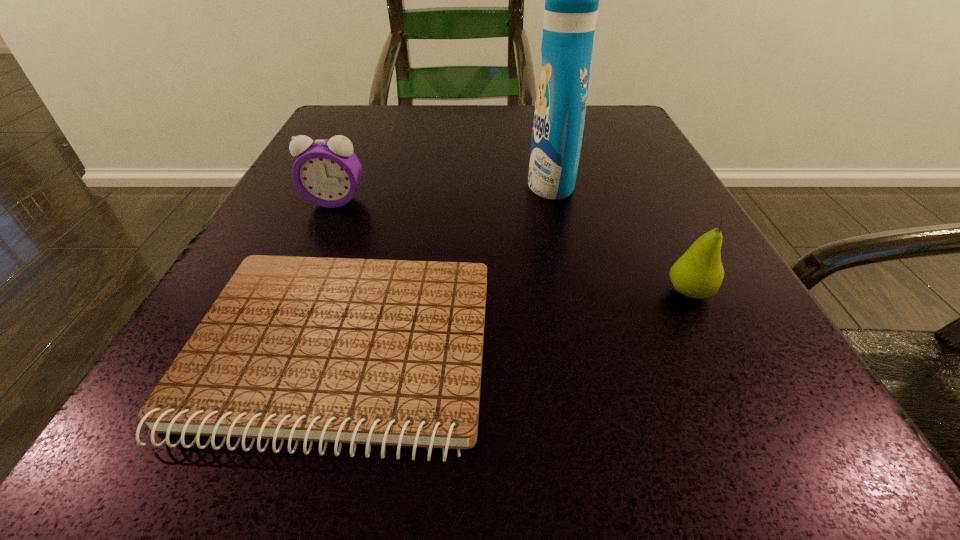
Find the location of `blank space located 0.100m on the back of the notebook`. blank space located 0.100m on the back of the notebook is located at coordinates (379, 228).

Image resolution: width=960 pixels, height=540 pixels. Find the location of `object that is at the near edge`. object that is at the near edge is located at coordinates (387, 352).

Locate an element on the screen. alarm clock that is at the left edge is located at coordinates (327, 173).

This screenshot has height=540, width=960. What are the coordinates of `notebook at the left edge` in the screenshot? It's located at (387, 352).

What are the coordinates of `object situated at the right edge` in the screenshot? It's located at (698, 273).

The height and width of the screenshot is (540, 960). Find the location of `object located at the near left corner`. object located at the near left corner is located at coordinates (387, 352).

Where is `vacant space at the far edge of the desktop`? This screenshot has height=540, width=960. vacant space at the far edge of the desktop is located at coordinates (454, 136).

The height and width of the screenshot is (540, 960). Find the location of `free space at the left edge of the desktop`. free space at the left edge of the desktop is located at coordinates point(234,262).

In the image, there is a desktop. Where is `free region at the right edge`? free region at the right edge is located at coordinates (670, 226).

The image size is (960, 540). I want to click on vacant space at the far left corner of the desktop, so click(394, 134).